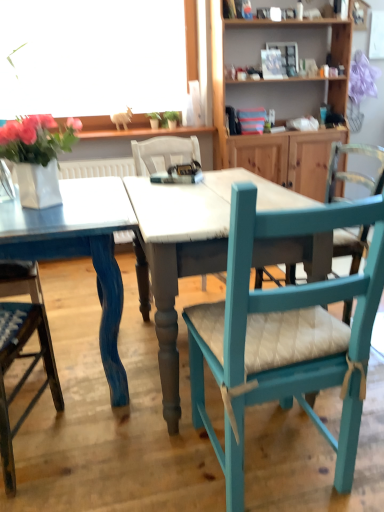
Question: Based on their sizes in the image, would you say white glossy vase at upper left is bigger or smaller than teal painted wood chair at right, arranged as the first chair when viewed from the right?

Choices:
 (A) big
 (B) small

Answer: (B)

Question: Considering their positions, is white glossy vase at upper left located in front of or behind teal painted wood chair at right, arranged as the first chair when viewed from the right?

Choices:
 (A) front
 (B) behind

Answer: (B)

Question: Based on their relative distances, which object is farther from the wooden cabinet at upper right?

Choices:
 (A) blue painted wood table at center
 (B) white glossy vase at upper left
 (C) teal painted wood chair at right, acting as the 2th chair starting from the left
 (D) wooden chair with cushion at lower left, which is the first chair in left-to-right order

Answer: (C)

Question: Estimate the real-world distances between objects in this image. Which object is closer to the wooden cabinet at upper right?

Choices:
 (A) wooden chair with cushion at lower left, which is the first chair in left-to-right order
 (B) white glossy vase at upper left
 (C) blue painted wood table at center
 (D) teal painted wood chair at right, arranged as the first chair when viewed from the right

Answer: (C)